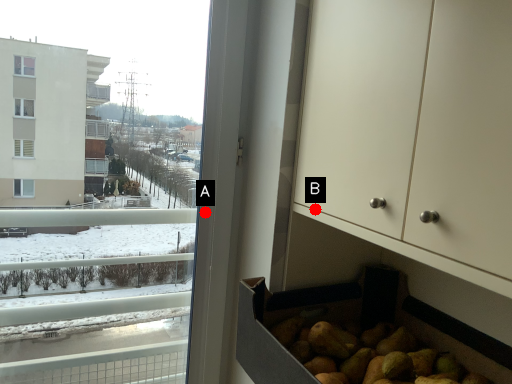
Question: Two points are circled on the image, labeled by A and B beside each circle. Which of the following is the farthest from the observer?

Choices:
 (A) A is further
 (B) B is further

Answer: (A)